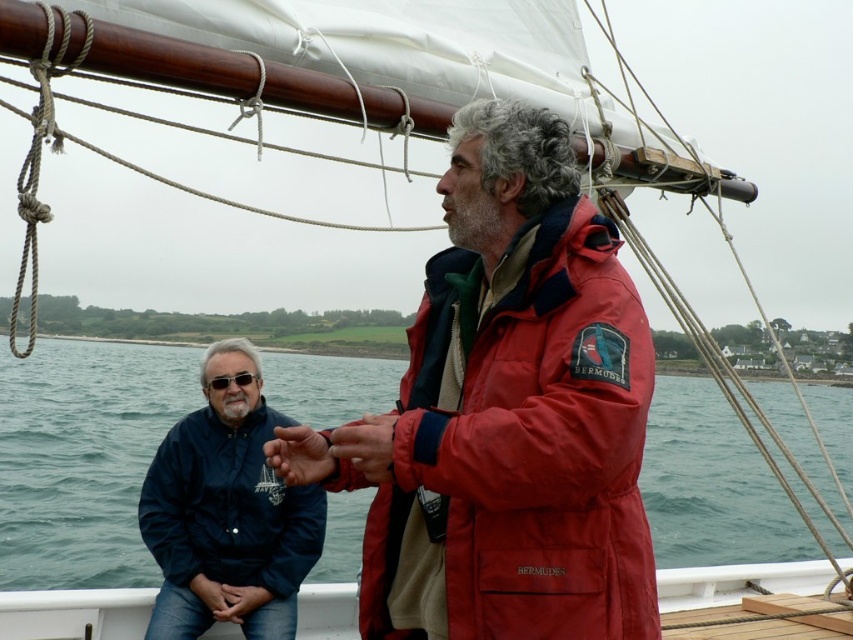
You are a photographer holding a camera and want to take a closeup shot of the matte red glove at center. Given that you are 3.70 meters away from the glove, can you get a clear closeup without moving closer?

The distance between you and the matte red glove at center is 3.70 meters. Whether you can get a clear closeup depends on your camera lens. If your camera has a zoom lens with sufficient focal length, you can achieve a closeup without moving closer. Otherwise, you might need to adjust your position or use a different lens.

You are a sailor on the deck of the sailboat. You notice the red matte jacket at center and the smooth skin hand at center. Which object is closer to you?

The red matte jacket at center is closer to you because it is in front of the smooth skin hand at center.